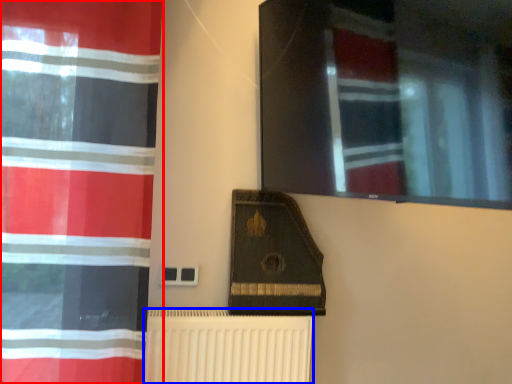
Question: Which of the following is the closest to the observer, curtain (highlighted by a red box) or radiator (highlighted by a blue box)?

Choices:
 (A) curtain
 (B) radiator

Answer: (A)